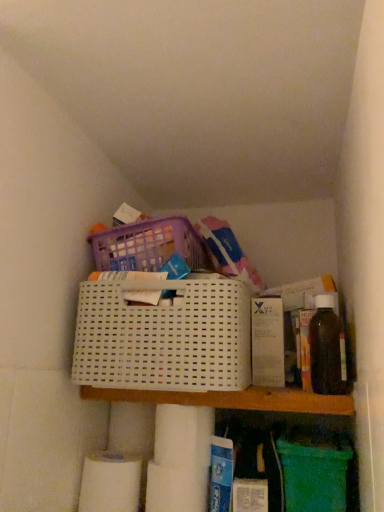
Question: Is white matte toilet paper at lower center, placed as the first toilet paper when sorted from right to left, taller or shorter than white matte toilet paper at lower left, the 2th toilet paper in the top-to-bottom sequence?

Choices:
 (A) tall
 (B) short

Answer: (B)

Question: In terms of width, does white matte toilet paper at lower center, which ranks as the second toilet paper in left-to-right order, look wider or thinner when compared to white matte toilet paper at lower left, placed as the 1th toilet paper when sorted from left to right?

Choices:
 (A) thin
 (B) wide

Answer: (A)

Question: Considering the real-world distances, which object is closest to the translucent amber bottle at right?

Choices:
 (A) white plastic basket at center
 (B) white matte toilet paper at lower left, which appears as the 2th toilet paper when viewed from the right
 (C) white matte toilet paper at lower center, which ranks as the second toilet paper in left-to-right order
 (D) white plastic shelf at center

Answer: (D)

Question: Considering the real-world distances, which object is farthest from the translucent amber bottle at right?

Choices:
 (A) white matte toilet paper at lower center, the second toilet paper ordered from the bottom
 (B) white matte toilet paper at lower left, placed as the 1th toilet paper when sorted from left to right
 (C) white plastic shelf at center
 (D) white plastic basket at center

Answer: (B)